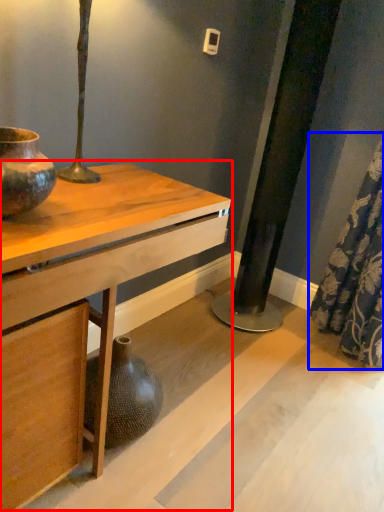
Question: Which object is closer to the camera taking this photo, table (highlighted by a red box) or shower curtain (highlighted by a blue box)?

Choices:
 (A) table
 (B) shower curtain

Answer: (A)